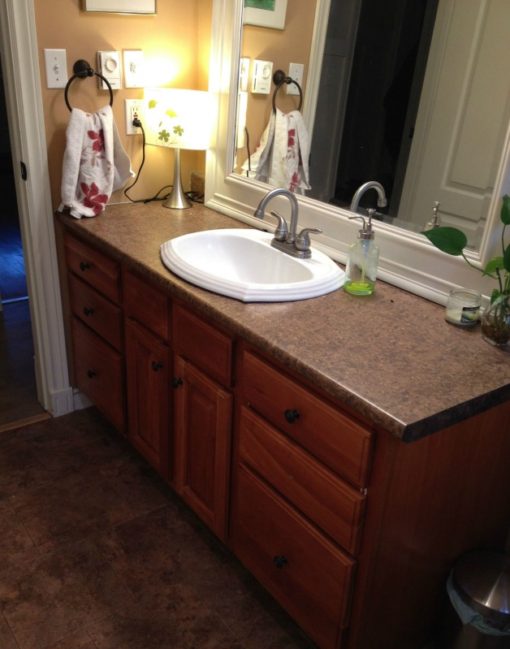
Locate an element on the screen. The image size is (510, 649). hand towel is located at coordinates (100, 162).